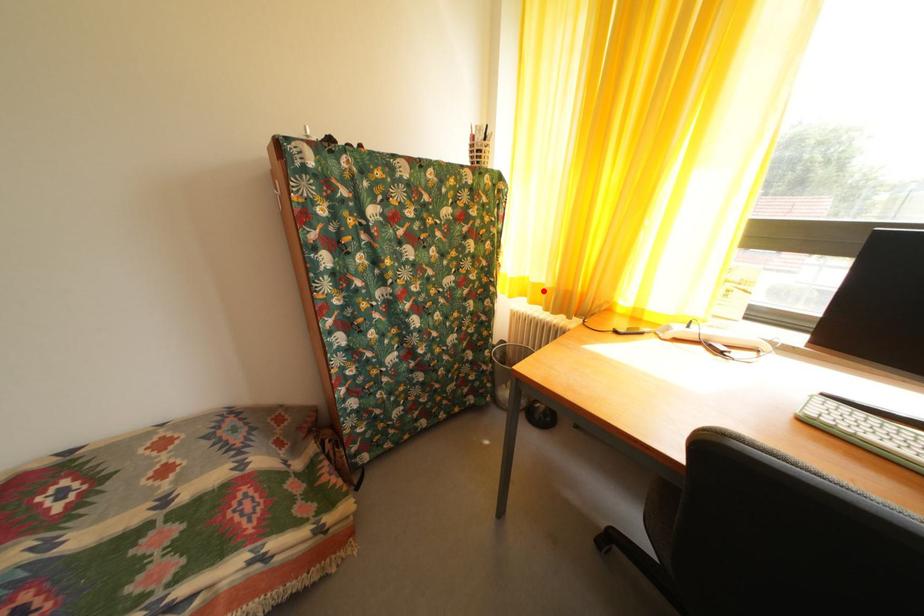
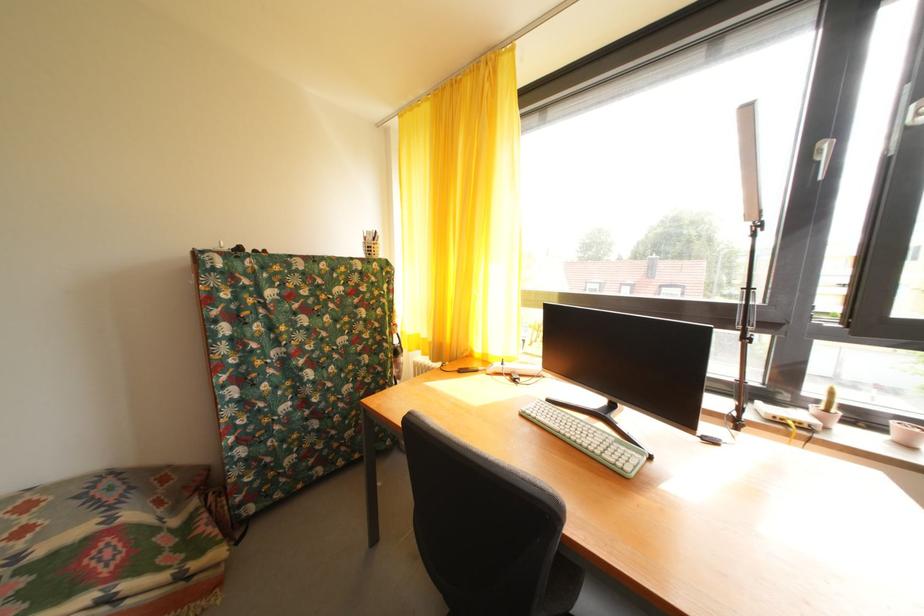
Find the pixel in the second image that matches the highlighted location in the first image.

(432, 346)